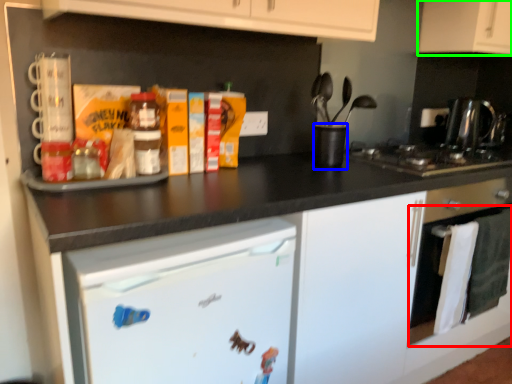
Question: Which object is the closest to the oven (highlighted by a red box)? Choose among these: appliance (highlighted by a blue box) or cabinetry (highlighted by a green box).

Choices:
 (A) appliance
 (B) cabinetry

Answer: (A)